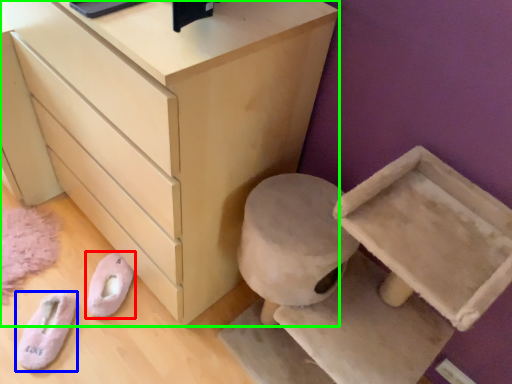
Question: Which is farther away from footwear (highlighted by a red box)? footwear (highlighted by a blue box) or chest of drawers (highlighted by a green box)?

Choices:
 (A) footwear
 (B) chest of drawers

Answer: (B)